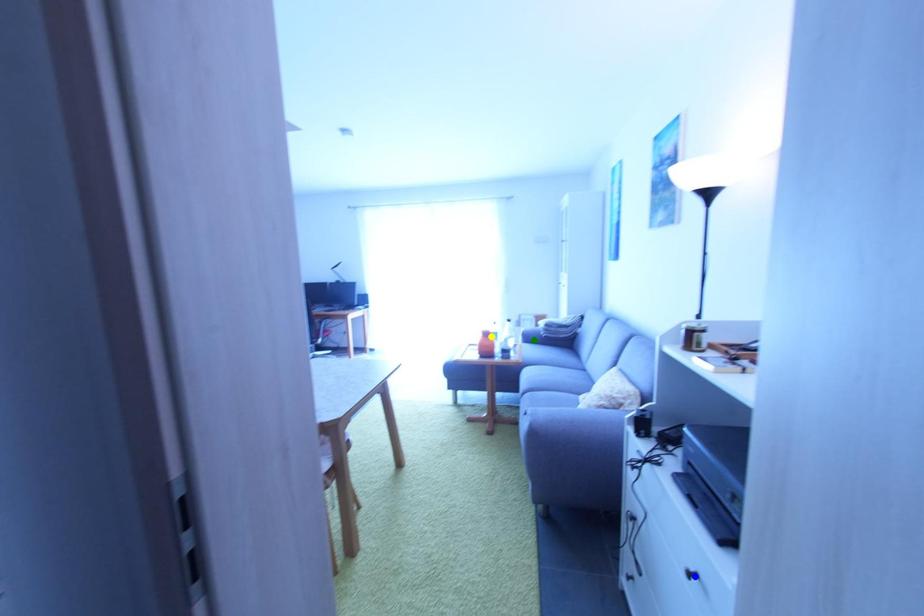
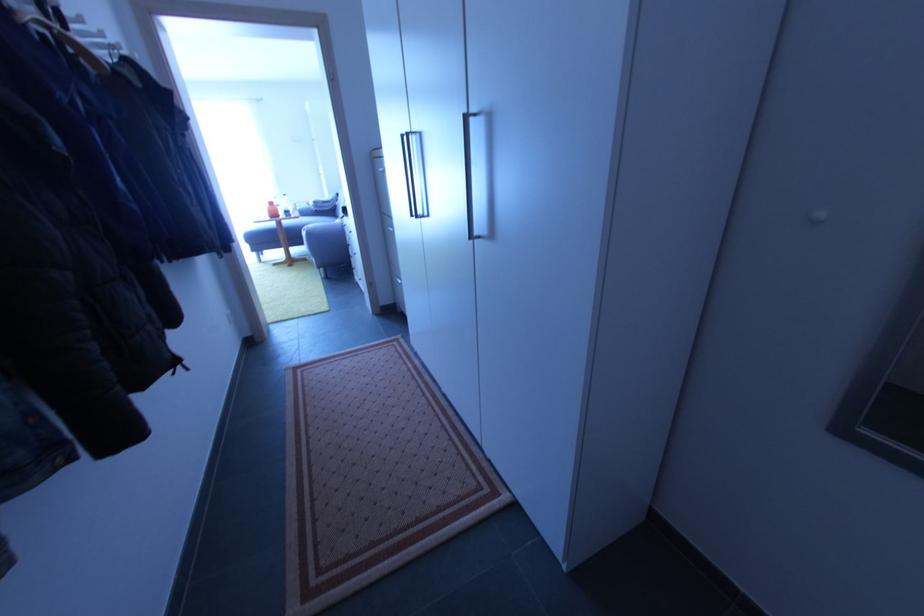
I am providing you with two images of the same scene from different viewpoints. Three points are marked in image1. Which point corresponds to a part or object that is occluded in image2?In image1, three points are marked. Which of them correspond to a part or object that is occluded in image2?Among the three points shown in image1, which one corresponds to a part or object that is no longer visible due to occlusion in image2?

blue point